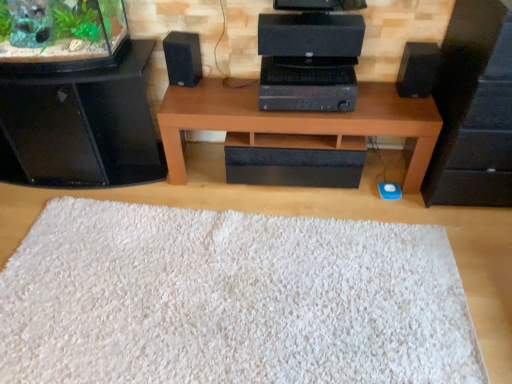
What are the coordinates of `vacant region to the left of black matte speaker at right, the 2th speaker viewed from the left` in the screenshot? It's located at (377, 97).